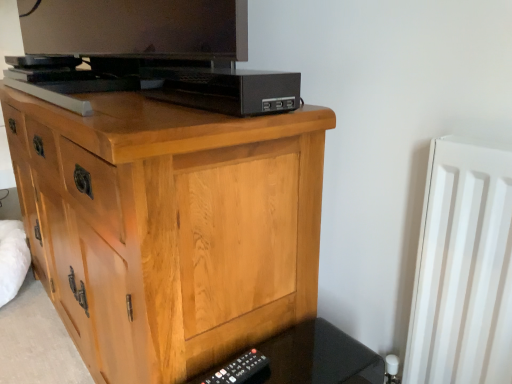
Question: Considering the relative sizes of light wood chest of drawers at center and black plastic remote at lower right in the image provided, is light wood chest of drawers at center taller than black plastic remote at lower right?

Choices:
 (A) yes
 (B) no

Answer: (A)

Question: Can you confirm if light wood chest of drawers at center is wider than black plastic remote at lower right?

Choices:
 (A) no
 (B) yes

Answer: (B)

Question: From a real-world perspective, is light wood chest of drawers at center physically above black plastic remote at lower right?

Choices:
 (A) yes
 (B) no

Answer: (A)

Question: Does light wood chest of drawers at center lie behind black plastic remote at lower right?

Choices:
 (A) yes
 (B) no

Answer: (B)

Question: Can black plastic remote at lower right be found inside light wood chest of drawers at center?

Choices:
 (A) yes
 (B) no

Answer: (B)

Question: Does light wood chest of drawers at center have a larger size compared to black plastic remote at lower right?

Choices:
 (A) yes
 (B) no

Answer: (A)

Question: Would you consider black plastic remote at lower right to be distant from black plastic usb hub at upper center?

Choices:
 (A) no
 (B) yes

Answer: (A)

Question: Is black plastic remote at lower right oriented towards black plastic usb hub at upper center?

Choices:
 (A) no
 (B) yes

Answer: (A)

Question: Is black plastic remote at lower right beside black plastic usb hub at upper center?

Choices:
 (A) no
 (B) yes

Answer: (A)

Question: From the image's perspective, is black plastic remote at lower right on black plastic usb hub at upper center?

Choices:
 (A) no
 (B) yes

Answer: (A)

Question: Is black plastic remote at lower right to the left of black plastic usb hub at upper center from the viewer's perspective?

Choices:
 (A) yes
 (B) no

Answer: (B)

Question: Can you confirm if black plastic remote at lower right is shorter than black plastic usb hub at upper center?

Choices:
 (A) no
 (B) yes

Answer: (B)

Question: From a real-world perspective, is black plastic remote at lower right located beneath black plastic remote at lower right?

Choices:
 (A) yes
 (B) no

Answer: (B)